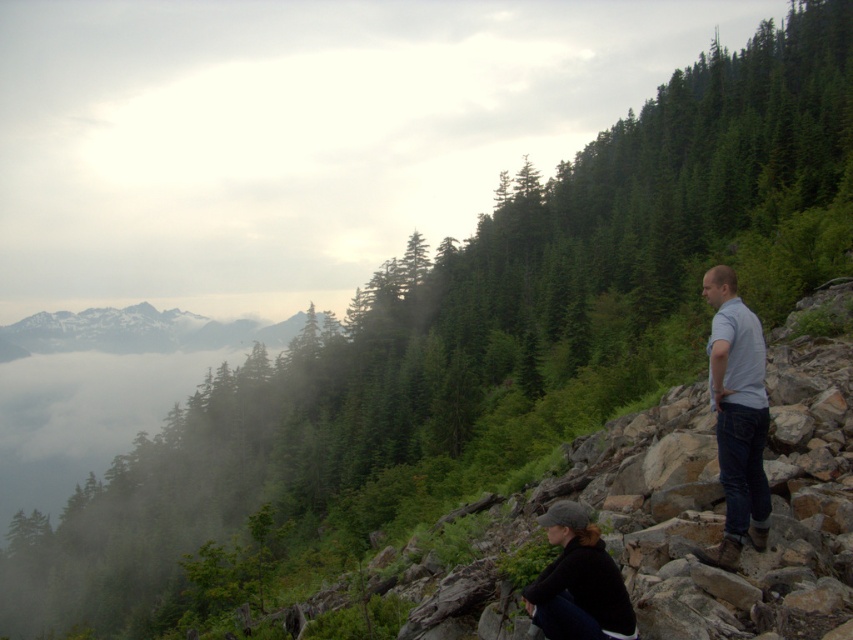
In the scene shown: You are standing at the point marked by the coordinates point (x=737, y=417). Looking around, you see light blue denim jeans at right. Which direction should you face to look towards the light blue denim jeans at right?

You should face towards the right direction to look towards the light blue denim jeans at right since the point (x=737, y=417) is located on the light blue denim jeans at right.

You are navigating a drone over the landscape shown in the image. The drone needs to drop a small package at the exact location of the light blue denim jeans at right. According to the coordinate system where the bottom left corner is the origin, can you confirm if the coordinates provided in the description are suitable for the drop?

The light blue denim jeans at right is located at point (737, 417), so yes, the coordinates provided in the description are suitable for the drone to drop the package at that exact location.